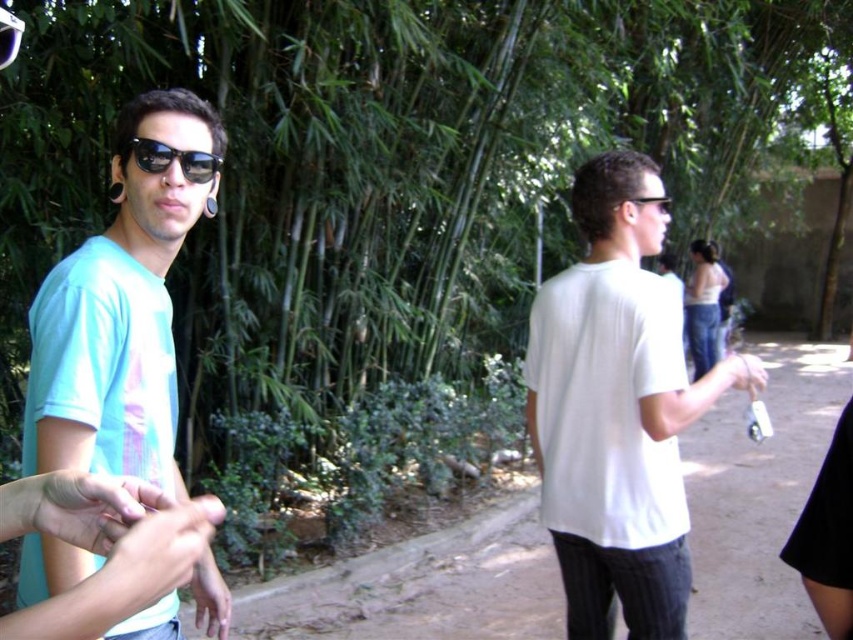
You are standing at the camera position and want to reach both the point at coordinates [740,376] and the point at coordinates [666,196]. Which point will you reach first?

You will reach point [740,376] first because it is closer to the camera than point [666,196].

You are standing at the point with coordinates point (206, 592) and want to walk to point (752, 368). Which direction should you move relative to your current position?

Since point (206, 592) is closer to the viewer than point (752, 368), you should move backward to reach point (752, 368) from your current position.